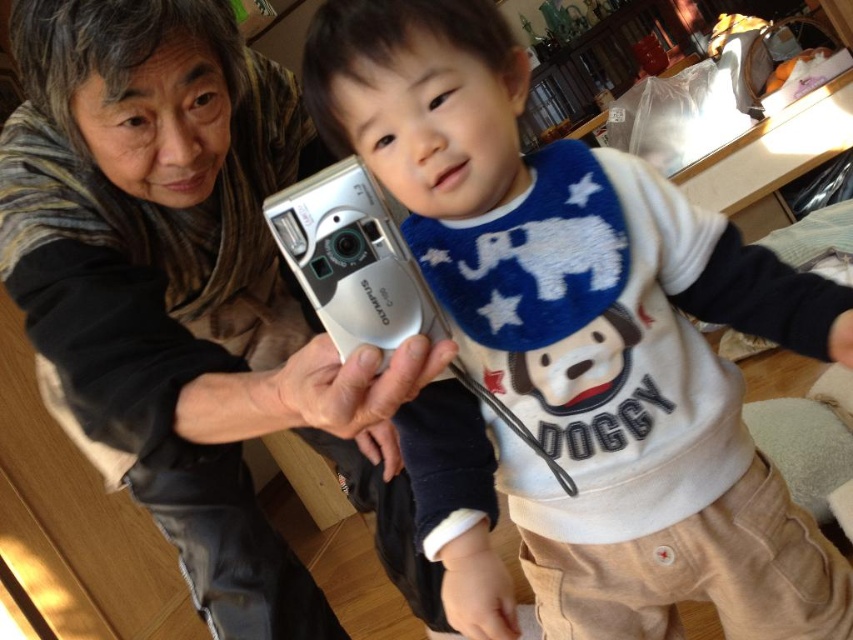
Does white soft fabric bib at center appear on the left side of matte silver camera at center?

In fact, white soft fabric bib at center is to the right of matte silver camera at center.

Does point (451, 401) come closer to viewer compared to point (276, 250)?

Yes, point (451, 401) is closer to viewer.

I want to click on white soft fabric bib at center, so click(x=576, y=349).